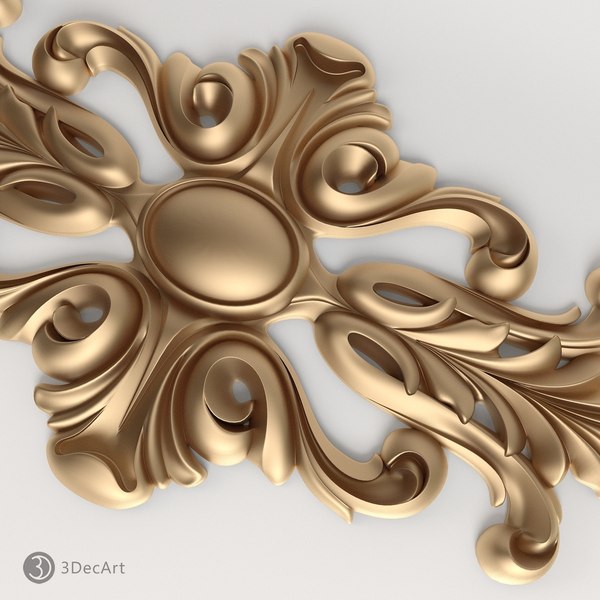
This screenshot has width=600, height=600. In order to click on tear drop size holee in wall art in this screenshot , I will do `click(375, 357)`, `click(398, 297)`, `click(53, 185)`, `click(93, 150)`.